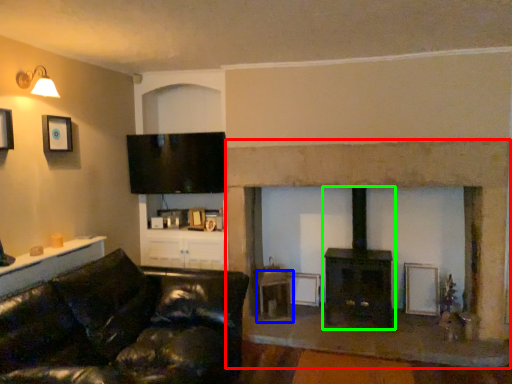
Question: Which object is positioned closest to fireplace (highlighted by a red box)? Select from table (highlighted by a blue box) and wood burning stove (highlighted by a green box).

Choices:
 (A) table
 (B) wood burning stove

Answer: (B)